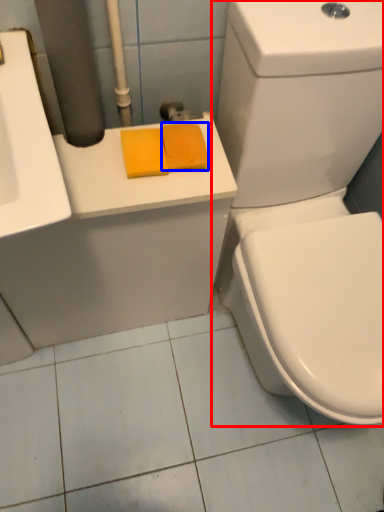
Question: Which object is closer to the camera taking this photo, toilet (highlighted by a red box) or soap (highlighted by a blue box)?

Choices:
 (A) toilet
 (B) soap

Answer: (A)